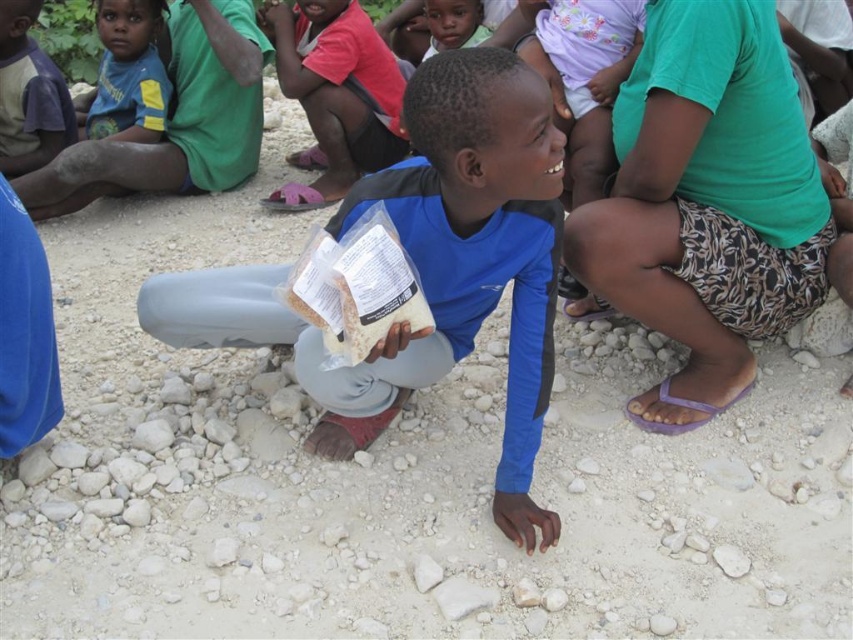
You are a photographer taking a picture of the scene. The green fabric shorts at right and the smooth skin child at center are both in the frame. Which object is bigger in the photo?

The green fabric shorts at right has a larger size compared to the smooth skin child at center, so it appears bigger in the photo.